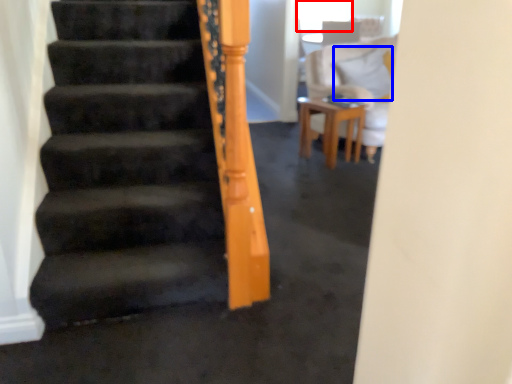
Question: Which of the following is the farthest to the observer, window screen (highlighted by a red box) or pillow (highlighted by a blue box)?

Choices:
 (A) window screen
 (B) pillow

Answer: (A)